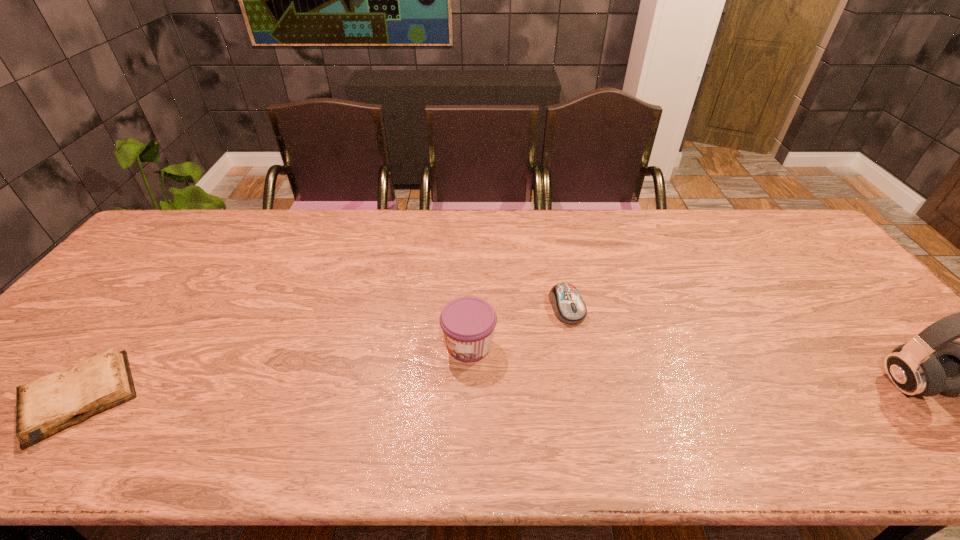
In the image, there is a desktop. Where is `vacant space at the far edge`? vacant space at the far edge is located at coordinates tap(546, 219).

In the image, there is a desktop. At what (x,y) coordinates should I click in order to perform the action: click on vacant space at the near edge. Please return your answer as a coordinate pair (x, y). This screenshot has width=960, height=540. Looking at the image, I should click on (503, 412).

This screenshot has width=960, height=540. Find the location of `vacant region at the left edge of the desktop`. vacant region at the left edge of the desktop is located at coordinates (132, 296).

Where is `free space at the right edge of the desktop`? free space at the right edge of the desktop is located at coordinates (829, 284).

Locate an element on the screen. vacant space at the far left corner of the desktop is located at coordinates (212, 209).

Find the location of `vacant space at the far right corner of the desktop`. vacant space at the far right corner of the desktop is located at coordinates (785, 215).

Identify the location of unoccupied area between the third tallest object and the jam. (518, 326).

Identify which object is the third closest to the leftmost object. Please provide its 2D coordinates. Your answer should be formatted as a tuple, i.e. [(x, y)], where the tuple contains the x and y coordinates of a point satisfying the conditions above.

[(931, 363)]

The image size is (960, 540). I want to click on the closest object relative to the third object from left to right, so click(x=468, y=323).

The height and width of the screenshot is (540, 960). Identify the location of free space that satisfies the following two spatial constraints: 1. on the back side of the third shortest object; 2. on the left side of the third tallest object. (469, 307).